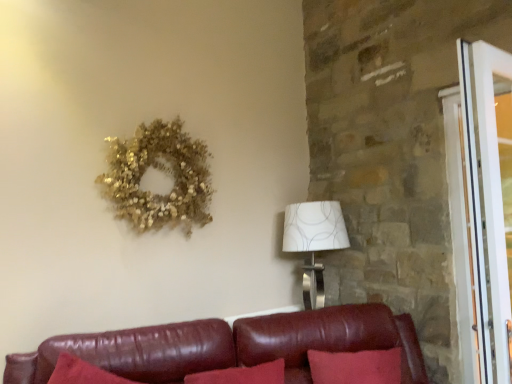
Question: From the image's perspective, is leather couch at lower center above white glossy screen door at right?

Choices:
 (A) no
 (B) yes

Answer: (A)

Question: Considering the relative positions of leather couch at lower center and white glossy screen door at right in the image provided, is leather couch at lower center to the left of white glossy screen door at right from the viewer's perspective?

Choices:
 (A) yes
 (B) no

Answer: (A)

Question: Is leather couch at lower center positioned behind white glossy screen door at right?

Choices:
 (A) yes
 (B) no

Answer: (B)

Question: Is leather couch at lower center positioned in front of white glossy screen door at right?

Choices:
 (A) no
 (B) yes

Answer: (B)

Question: Is leather couch at lower center to the right of white glossy screen door at right from the viewer's perspective?

Choices:
 (A) yes
 (B) no

Answer: (B)

Question: From a real-world perspective, does leather couch at lower center sit lower than white glossy screen door at right?

Choices:
 (A) yes
 (B) no

Answer: (A)

Question: From a real-world perspective, is gold glittery wreath at upper left positioned over white textured lampshade at right based on gravity?

Choices:
 (A) no
 (B) yes

Answer: (B)

Question: From a real-world perspective, is gold glittery wreath at upper left below white textured lampshade at right?

Choices:
 (A) yes
 (B) no

Answer: (B)

Question: Is gold glittery wreath at upper left completely or partially outside of white textured lampshade at right?

Choices:
 (A) yes
 (B) no

Answer: (A)

Question: Can you confirm if gold glittery wreath at upper left is wider than white textured lampshade at right?

Choices:
 (A) yes
 (B) no

Answer: (B)

Question: Is gold glittery wreath at upper left not near white textured lampshade at right?

Choices:
 (A) no
 (B) yes

Answer: (A)

Question: Can white textured lampshade at right be found inside gold glittery wreath at upper left?

Choices:
 (A) no
 (B) yes

Answer: (A)

Question: Considering the relative sizes of gold glittery wreath at upper left and leather couch at lower center in the image provided, is gold glittery wreath at upper left taller than leather couch at lower center?

Choices:
 (A) no
 (B) yes

Answer: (B)